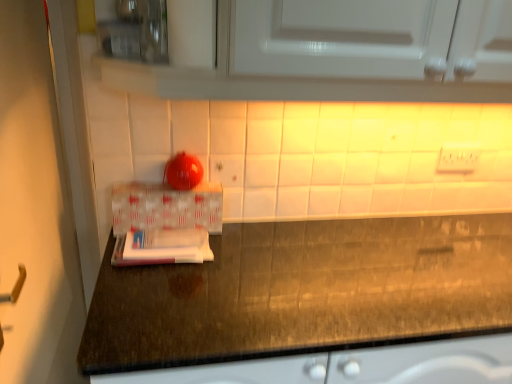
Question: From the image's perspective, is white plastic electric outlet at upper center positioned above or below white woven box at center?

Choices:
 (A) above
 (B) below

Answer: (A)

Question: Considering their positions, is white plastic electric outlet at upper center located in front of or behind white woven box at center?

Choices:
 (A) behind
 (B) front

Answer: (A)

Question: Is white plastic electric outlet at upper center taller or shorter than white woven box at center?

Choices:
 (A) tall
 (B) short

Answer: (B)

Question: Does point (141, 196) appear closer or farther from the camera than point (474, 152)?

Choices:
 (A) farther
 (B) closer

Answer: (B)

Question: In the image, is white woven box at center on the left side or the right side of white plastic electric outlet at upper center?

Choices:
 (A) right
 (B) left

Answer: (B)

Question: Is white woven box at center situated inside white plastic electric outlet at upper center or outside?

Choices:
 (A) inside
 (B) outside

Answer: (B)

Question: Considering the positions of white woven box at center and white plastic electric outlet at upper center in the image, is white woven box at center wider or thinner than white plastic electric outlet at upper center?

Choices:
 (A) wide
 (B) thin

Answer: (A)